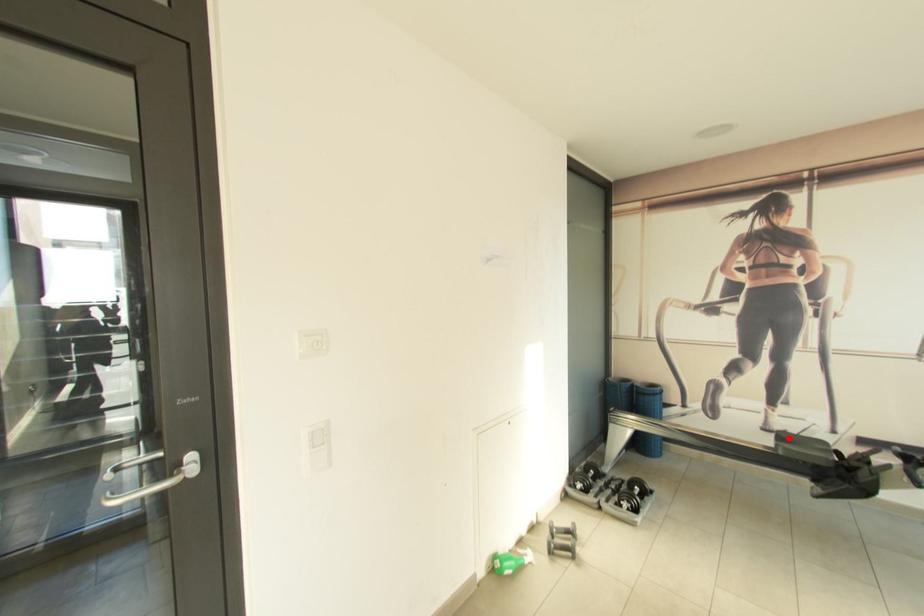
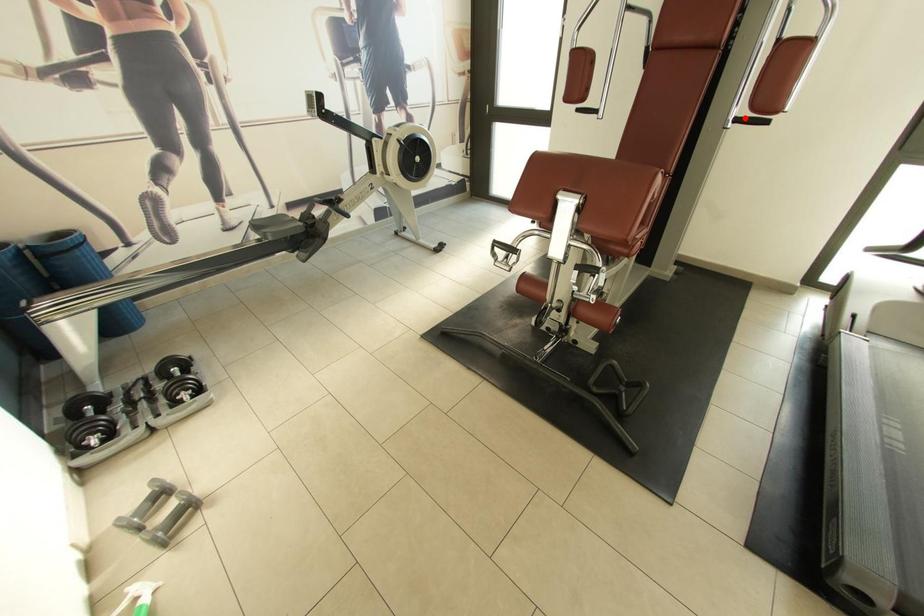
Consider the image. I am providing you with two images of the same scene from different viewpoints. A red point is marked on the first image and another point is marked on the second image. Is the red point in image1 aligned with the point shown in image2?

No